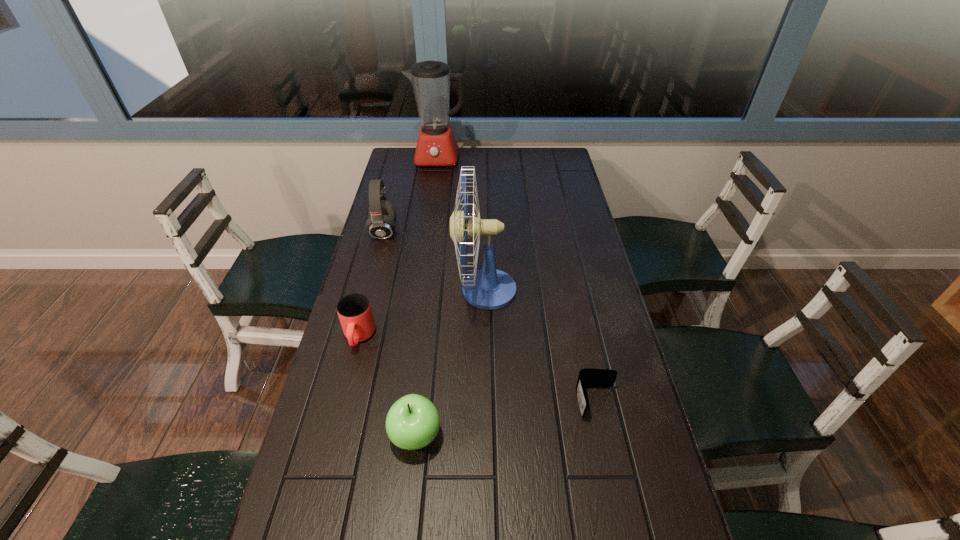
The image size is (960, 540). Find the location of `empty space that is in between the headset and the cup`. empty space that is in between the headset and the cup is located at coordinates (372, 284).

Image resolution: width=960 pixels, height=540 pixels. I want to click on the third closest object to the third tallest object, so click(436, 146).

At what (x,y) coordinates should I click in order to perform the action: click on object that is the fifth nearest to the cup. Please return your answer as a coordinate pair (x, y). Looking at the image, I should click on (436, 146).

Find the location of a particular element. vacant region that satisfies the following two spatial constraints: 1. on the front of the apple near the controls; 2. on the right side of the blender is located at coordinates (398, 436).